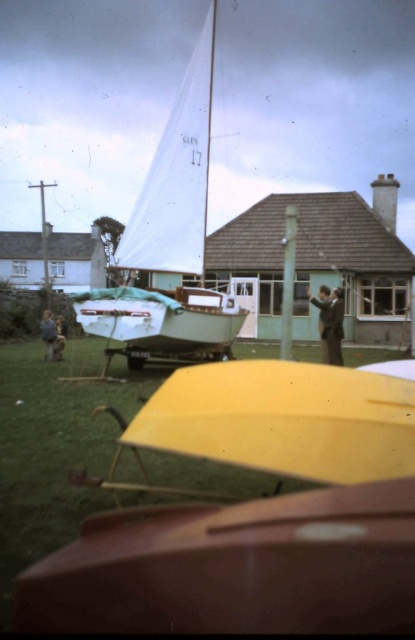
You are a painter setting up your easel to paint the scene. You want to ensure both the white matte sailboat at center and the dark brown leather jacket at center are clearly visible in your painting. Given their sizes, which object should you place closer to the front of your composition to maintain their visibility?

The white matte sailboat at center is much taller than the dark brown leather jacket at center, so to maintain visibility of both, you should place the dark brown leather jacket at center closer to the front of the composition. This way, its smaller size won

You are a delivery person who needs to place a dark brown leather jacket exactly 4 meters away from a white matte sailboat at center. Based on the scene, can you position the jacket at the current location of the dark brown leather jacket at center?

The white matte sailboat at center is currently 3.91 meters from the dark brown leather jacket at center. Since 3.91 meters is just slightly less than 4 meters, the jacket is already positioned close to the required distance, but not exactly 4 meters away. You may need to adjust its position slightly to meet the exact requirement.